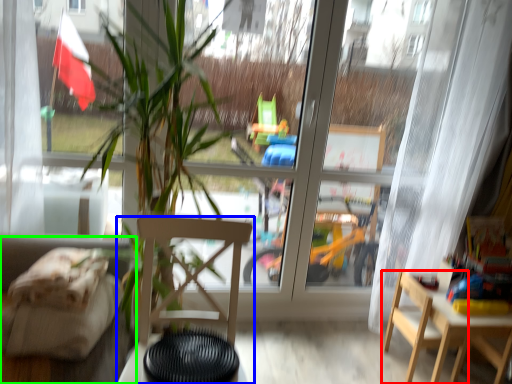
Question: Considering the real-world distances, which object is closest to chair (highlighted by a red box)? chair (highlighted by a blue box) or couch (highlighted by a green box).

Choices:
 (A) chair
 (B) couch

Answer: (A)